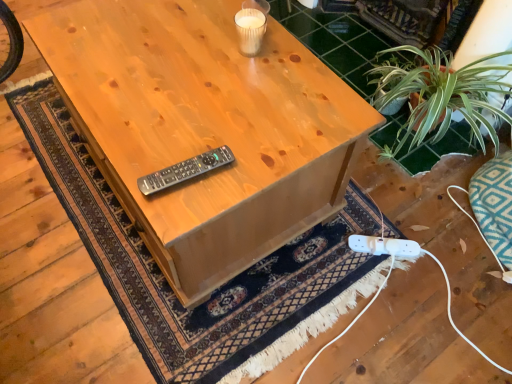
Where is `free location to the left of white plastic plug at lower right`? Image resolution: width=512 pixels, height=384 pixels. free location to the left of white plastic plug at lower right is located at coordinates (332, 251).